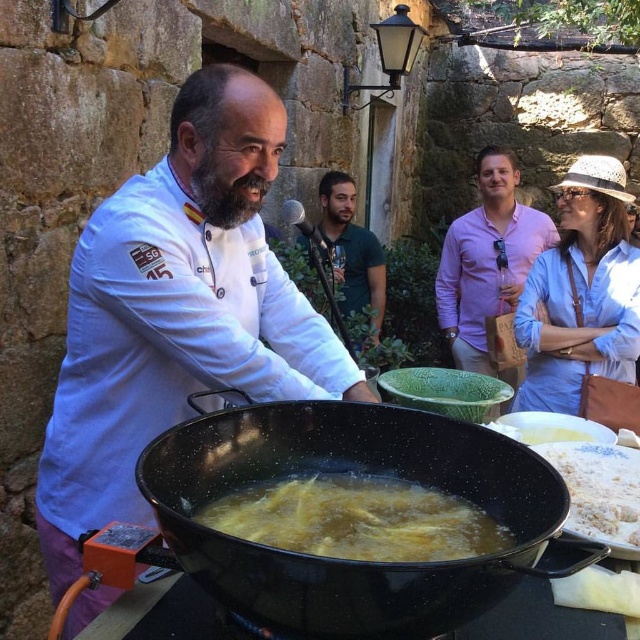
Question: Does pink cotton shirt at upper center appear under white flour at lower right?

Choices:
 (A) yes
 (B) no

Answer: (B)

Question: Observing the image, what is the correct spatial positioning of black speckled wok at center in reference to yellow matte food at center?

Choices:
 (A) left
 (B) right

Answer: (B)

Question: Among these points, which one is farthest from the camera?

Choices:
 (A) pos(339,244)
 (B) pos(109,422)

Answer: (A)

Question: Can you confirm if yellow matte food at center is bigger than pink cotton shirt at upper center?

Choices:
 (A) yes
 (B) no

Answer: (B)

Question: Which point appears closest to the camera in this image?

Choices:
 (A) (65, 362)
 (B) (333, 200)

Answer: (A)

Question: Which point is closer to the camera?

Choices:
 (A) white chef coat at center
 (B) pink cotton shirt at upper center
 (C) yellow matte food at center

Answer: (C)